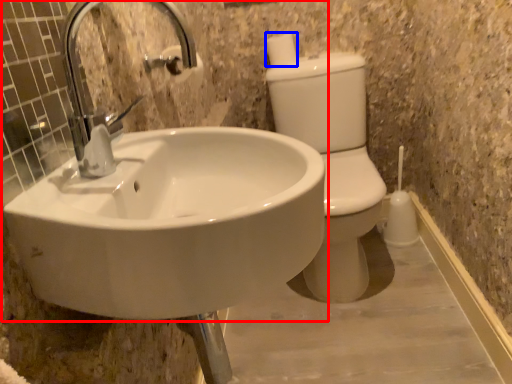
Question: Which object is further to the camera taking this photo, sink (highlighted by a red box) or toilet paper (highlighted by a blue box)?

Choices:
 (A) sink
 (B) toilet paper

Answer: (B)